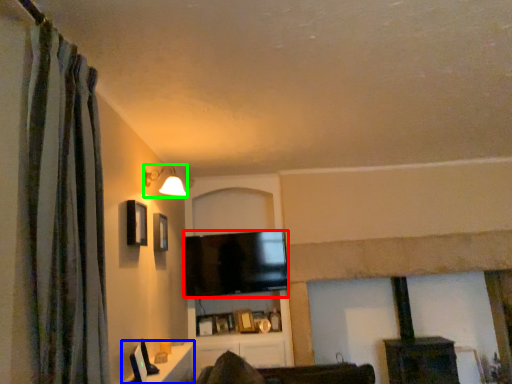
Question: Which object is the farthest from television (highlighted by a red box)? Choose among these: table (highlighted by a blue box) or light fixture (highlighted by a green box).

Choices:
 (A) table
 (B) light fixture

Answer: (A)